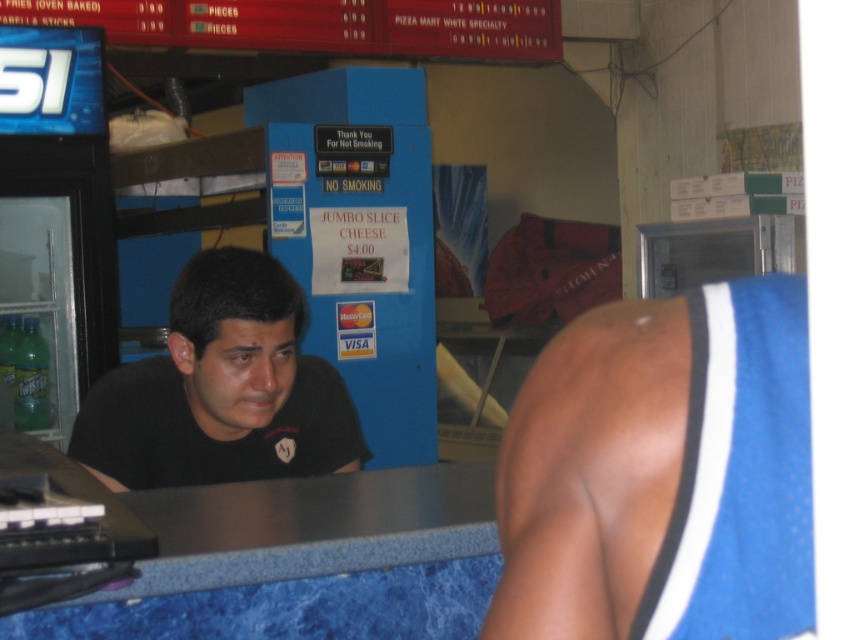
You are standing at the counter in the pizza shop and see two points marked on the floor. The first point is at coordinate point(589, 492) and the second point is at coordinate point(178, 358). Which point is closer to you?

Point(589, 492) is in front of point(178, 358), so the second point is closer to you.

You are a customer at the pizza shop and want to order a pizza. You see a man in a blue jersey at center and a man in a black matte shirt at center. Which of the two men is wearing a thinner garment?

The blue jersey at center is thinner than the black matte shirt at center, so the man in the blue jersey at center is wearing a thinner garment.